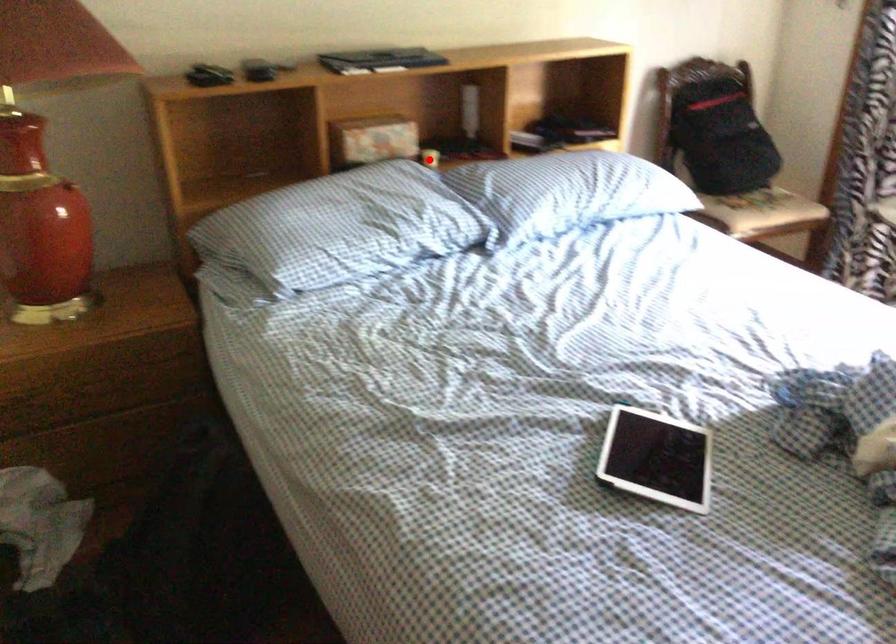
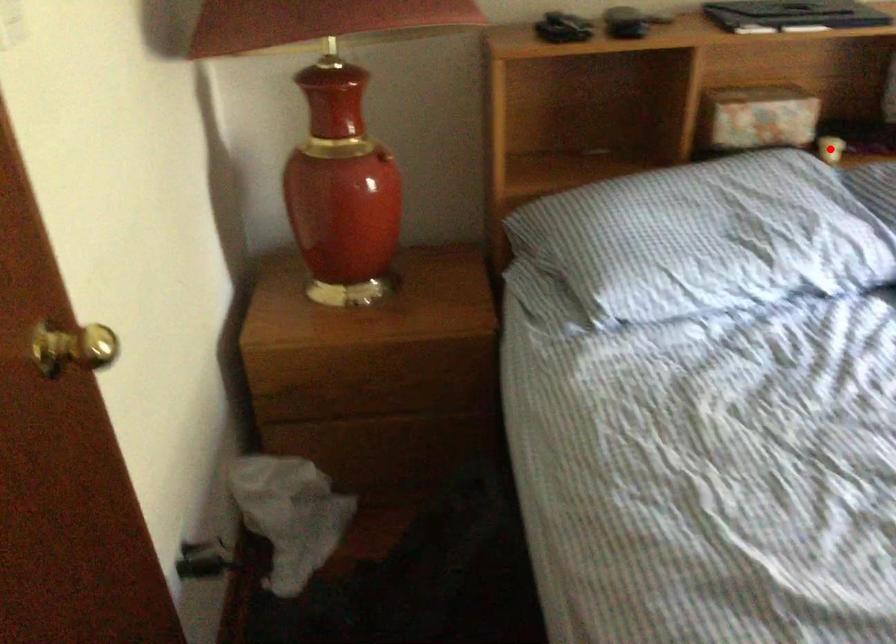
I am providing you with two images of the same scene from different viewpoints. A red point is marked on the first image and another point is marked on the second image. Are the points marked in image1 and image2 representing the same 3D position?

Yes